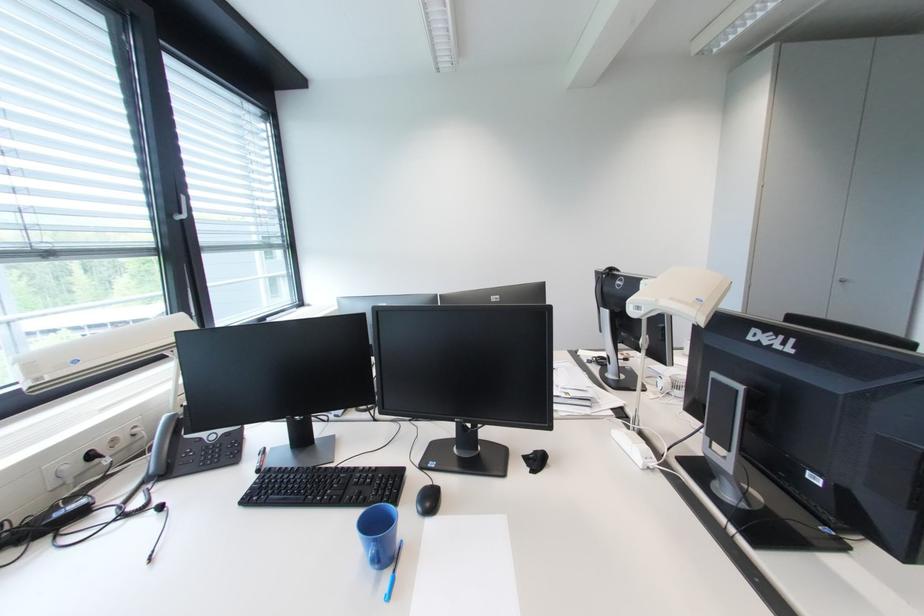
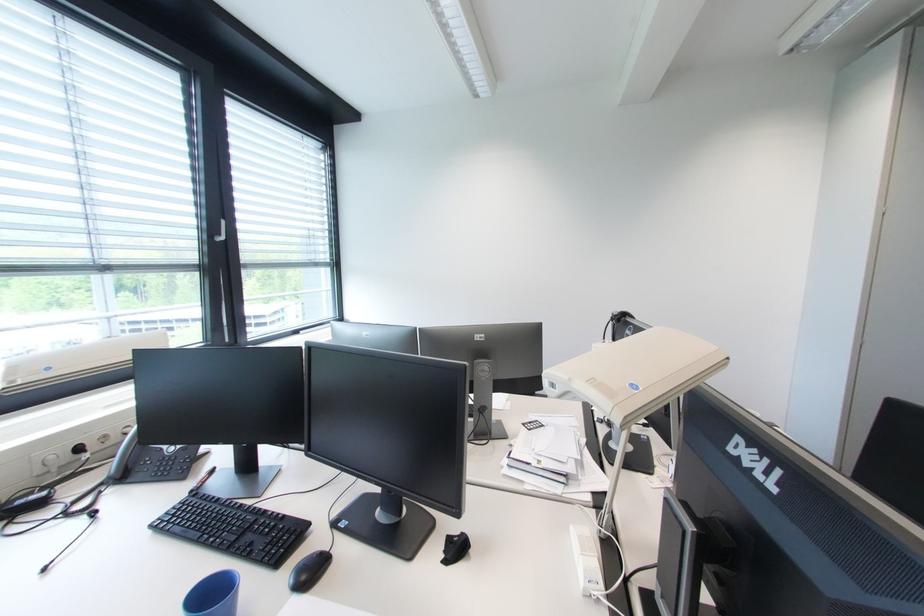
The images are taken continuously from a first-person perspective. In which direction are you moving?

The cameraman walked toward right, forward.